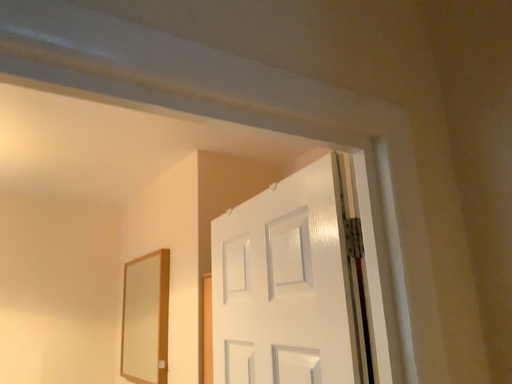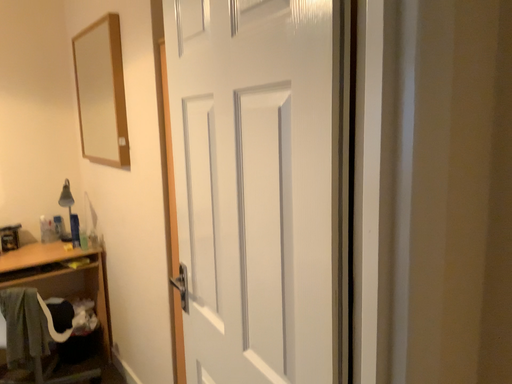
Question: Which way did the camera rotate in the video?

Choices:
 (A) rotated downward
 (B) rotated upward

Answer: (A)